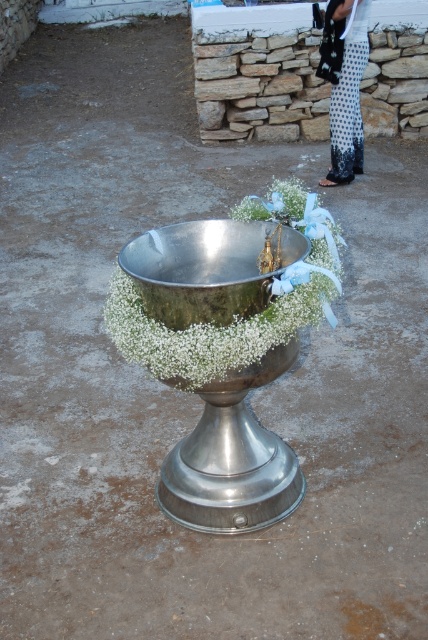
Question: Does silver metallic bowl at center have a lesser width compared to polka dot fabric pants at right?

Choices:
 (A) no
 (B) yes

Answer: (A)

Question: Which object is farther from the camera taking this photo?

Choices:
 (A) silver metallic bowl at center
 (B) polka dot fabric pants at right
 (C) metallic silver bowl at center

Answer: (B)

Question: Can you confirm if silver metallic bowl at center is bigger than polka dot fabric pants at right?

Choices:
 (A) yes
 (B) no

Answer: (B)

Question: Which of the following is the farthest from the observer?

Choices:
 (A) polka dot fabric pants at right
 (B) metallic silver bowl at center

Answer: (A)

Question: Which point is closer to the camera taking this photo?

Choices:
 (A) (356, 54)
 (B) (291, 332)
 (C) (252, 272)

Answer: (B)

Question: Can you confirm if silver metallic bowl at center is smaller than metallic silver bowl at center?

Choices:
 (A) yes
 (B) no

Answer: (B)